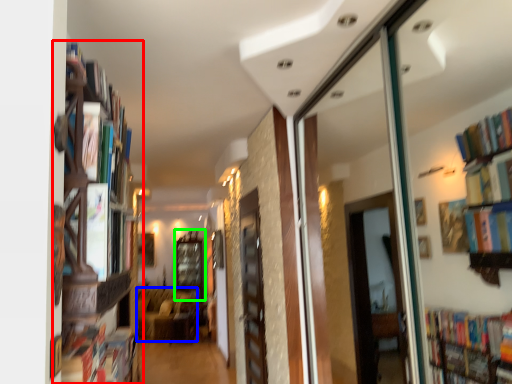
Question: Which object is positioned farthest from bookcase (highlighted by a red box)? Select from furniture (highlighted by a blue box) and window (highlighted by a green box).

Choices:
 (A) furniture
 (B) window

Answer: (B)